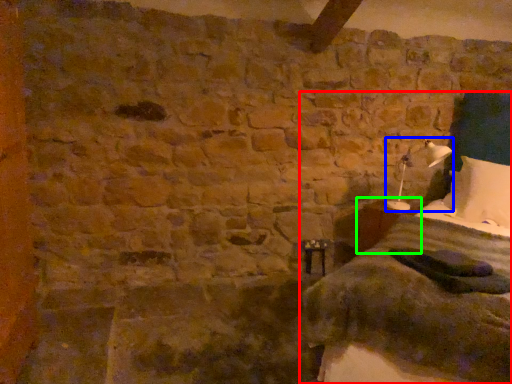
Question: Which is nearer to the bed (highlighted by a red box)? bedside lamp (highlighted by a blue box) or table (highlighted by a green box).

Choices:
 (A) bedside lamp
 (B) table

Answer: (B)